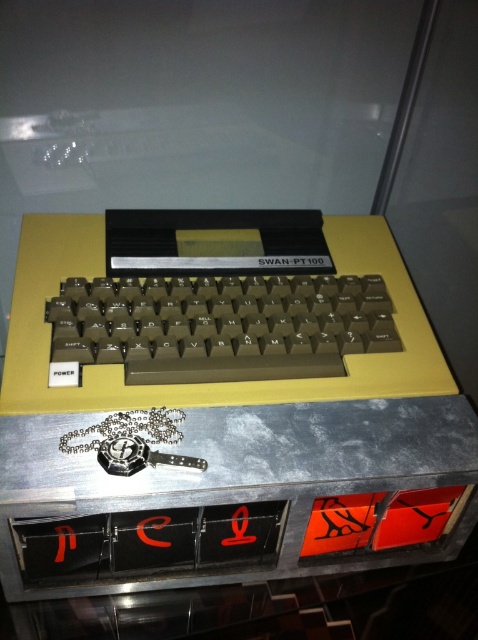
You are a museum curator arranging an exhibit. The vintage Swan PT100 typewriter is displayed in a glass case. You need to place a label next to the metallic silver table at center. Where should you position the label relative to the typewriter to ensure it aligns with the table?

The metallic silver table at center is located at point (x=219, y=410), so the label should be placed at that coordinate to align with the table.

You are a museum visitor standing in front of the glass case containing the vintage typewriter. You notice the metallic silver table at center and the matte plastic keyboard at center. According to the description, which object is positioned to the right of the other?

The metallic silver table at center is to the right of the matte plastic keyboard at center.